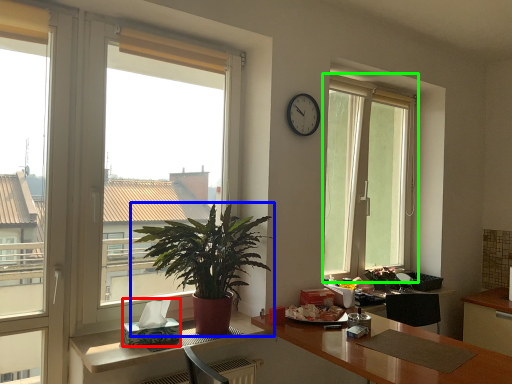
Question: Which is farther away from tissue paper (highlighted by a red box)? houseplant (highlighted by a blue box) or window (highlighted by a green box)?

Choices:
 (A) houseplant
 (B) window

Answer: (B)